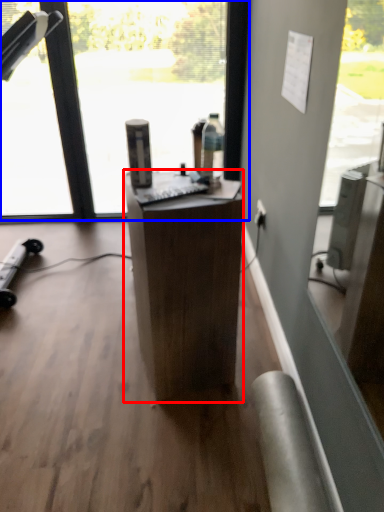
Question: Which object is closer to the camera taking this photo, desk (highlighted by a red box) or window (highlighted by a blue box)?

Choices:
 (A) desk
 (B) window

Answer: (A)